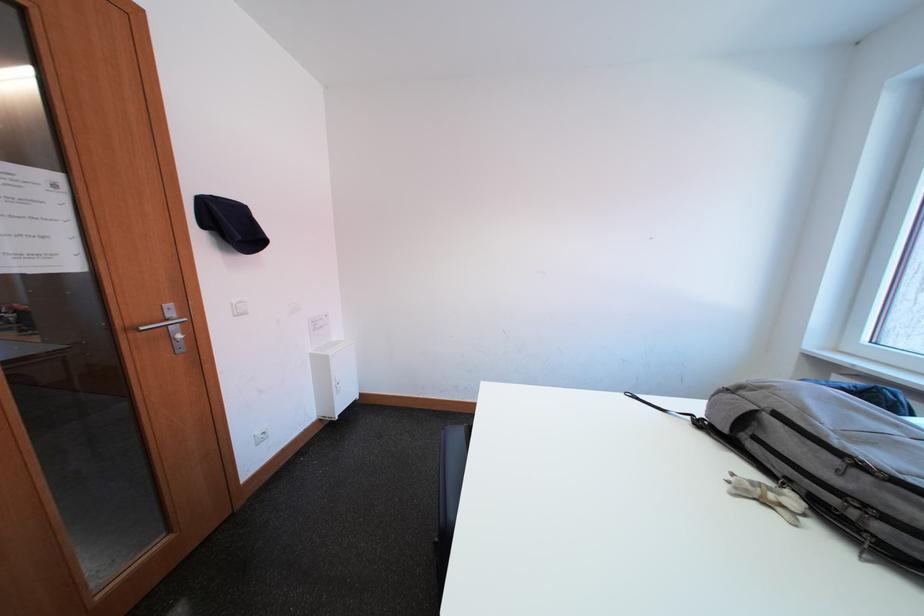
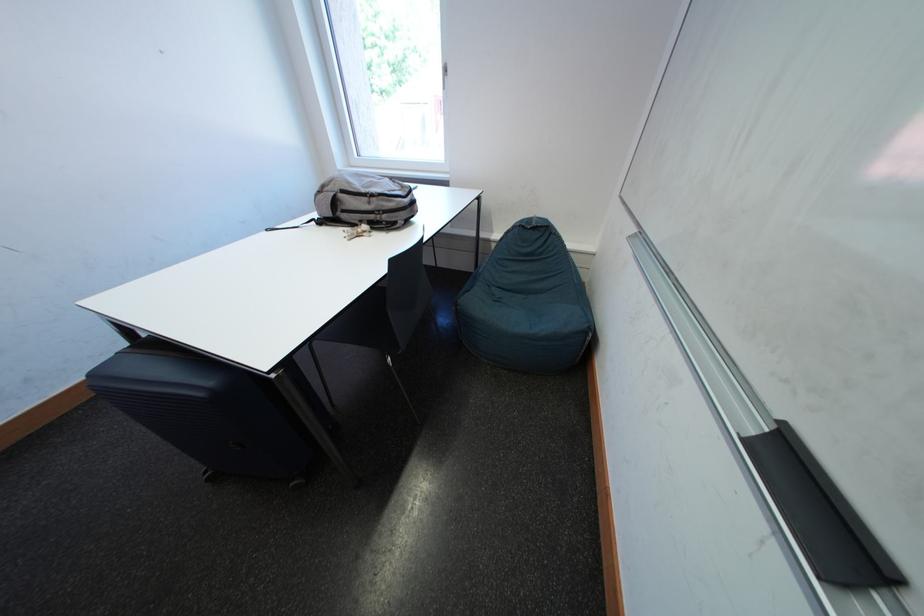
The point at (x=773, y=500) is marked in the first image. Where is the corresponding point in the second image?

(368, 236)